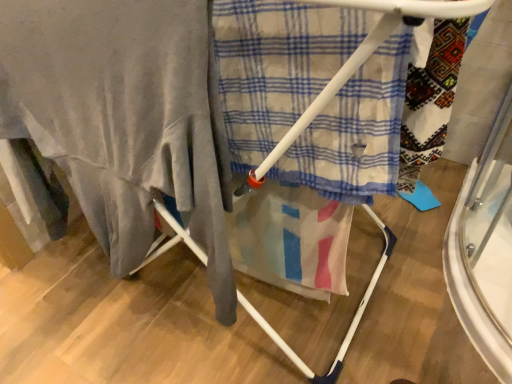
Question: Is white plastic drying rack at center closer to the viewer compared to plaid fabric at center?

Choices:
 (A) no
 (B) yes

Answer: (B)

Question: Is white plastic drying rack at center to the right of plaid fabric at center from the viewer's perspective?

Choices:
 (A) no
 (B) yes

Answer: (A)

Question: Is white plastic drying rack at center further to the viewer compared to plaid fabric at center?

Choices:
 (A) no
 (B) yes

Answer: (A)

Question: Is white plastic drying rack at center in contact with plaid fabric at center?

Choices:
 (A) yes
 (B) no

Answer: (A)

Question: Can you confirm if white plastic drying rack at center is wider than plaid fabric at center?

Choices:
 (A) yes
 (B) no

Answer: (A)

Question: From the image's perspective, is white plastic drying rack at center above plaid fabric at center?

Choices:
 (A) yes
 (B) no

Answer: (A)

Question: Considering the relative sizes of plaid fabric at center and matte gray blanket at left in the image provided, is plaid fabric at center thinner than matte gray blanket at left?

Choices:
 (A) yes
 (B) no

Answer: (A)

Question: Is plaid fabric at center placed right next to matte gray blanket at left?

Choices:
 (A) no
 (B) yes

Answer: (A)

Question: Does plaid fabric at center have a greater width compared to matte gray blanket at left?

Choices:
 (A) no
 (B) yes

Answer: (A)

Question: Considering the relative positions of plaid fabric at center and matte gray blanket at left in the image provided, is plaid fabric at center to the left of matte gray blanket at left from the viewer's perspective?

Choices:
 (A) no
 (B) yes

Answer: (A)

Question: Would you say plaid fabric at center contains matte gray blanket at left?

Choices:
 (A) yes
 (B) no

Answer: (B)

Question: Does plaid fabric at center appear on the right side of matte gray blanket at left?

Choices:
 (A) yes
 (B) no

Answer: (A)

Question: From a real-world perspective, is white plastic drying rack at center physically below matte gray blanket at left?

Choices:
 (A) yes
 (B) no

Answer: (A)